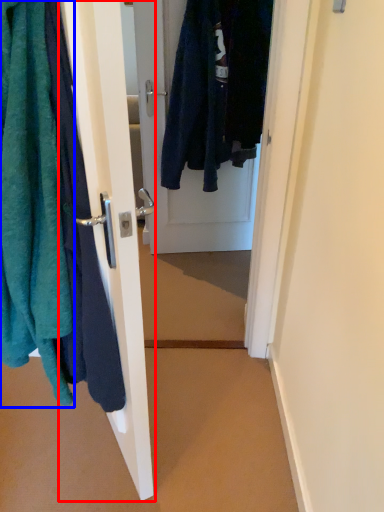
Question: Among these objects, which one is nearest to the camera, door (highlighted by a red box) or towel (highlighted by a blue box)?

Choices:
 (A) door
 (B) towel

Answer: (B)